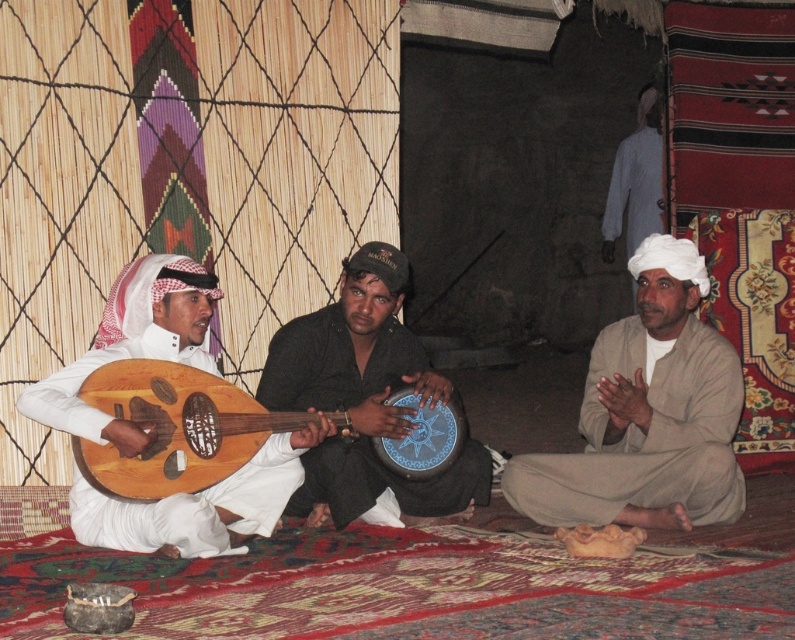
Does wooden lute at left appear over gray cotton shirt at upper right?

Actually, wooden lute at left is below gray cotton shirt at upper right.

Is wooden lute at left to the right of gray cotton shirt at upper right from the viewer's perspective?

In fact, wooden lute at left is to the left of gray cotton shirt at upper right.

Who is more distant from viewer, (78, 506) or (613, 188)?

The point (613, 188) is more distant.

Image resolution: width=795 pixels, height=640 pixels. Identify the location of wooden lute at left. (130, 344).

Is wooden banjo at left closer to camera compared to gray cotton shirt at upper right?

Yes, it is in front of gray cotton shirt at upper right.

Is point (266, 417) farther from viewer compared to point (653, 140)?

That is False.

Locate an element on the screen. The height and width of the screenshot is (640, 795). wooden banjo at left is located at coordinates click(x=173, y=428).

Can you confirm if dark brown leather drum at center is taller than wooden banjo at left?

Indeed, dark brown leather drum at center has a greater height compared to wooden banjo at left.

Who is more distant from viewer, (419, 355) or (161, 422)?

The point (419, 355) is behind.

Where is `dark brown leather drum at center`? The image size is (795, 640). dark brown leather drum at center is located at coordinates (365, 401).